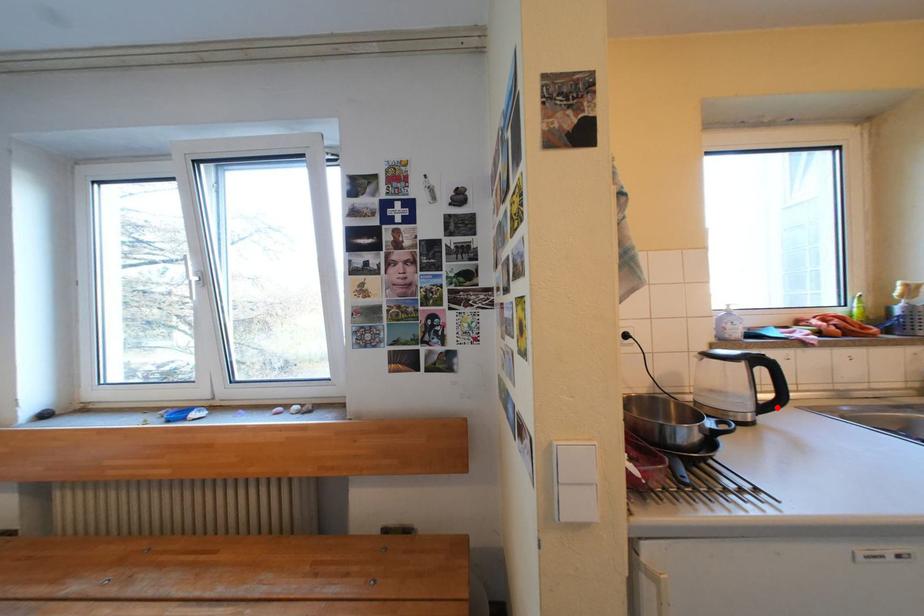
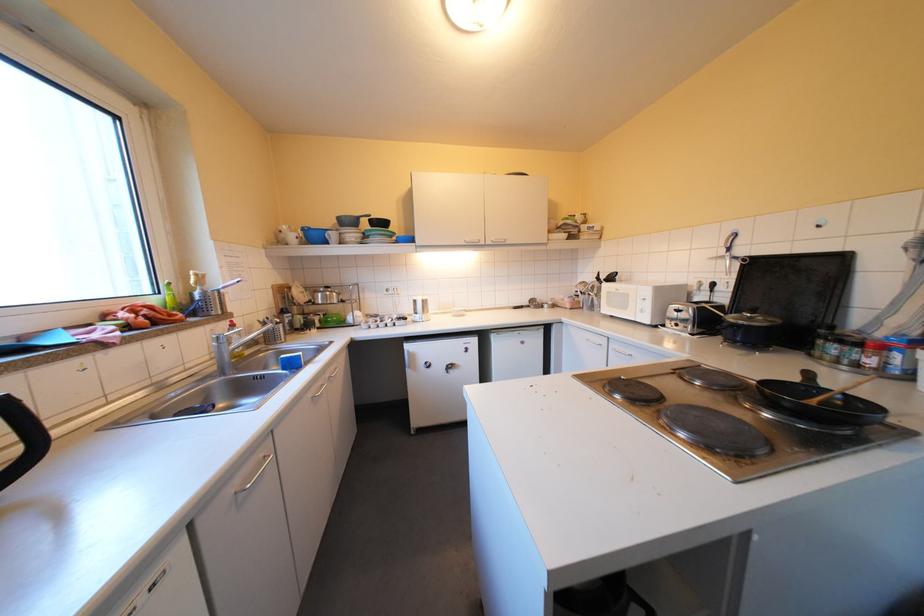
Where in the second image is the point corresponding to the highlighted location from the first image?

(17, 479)